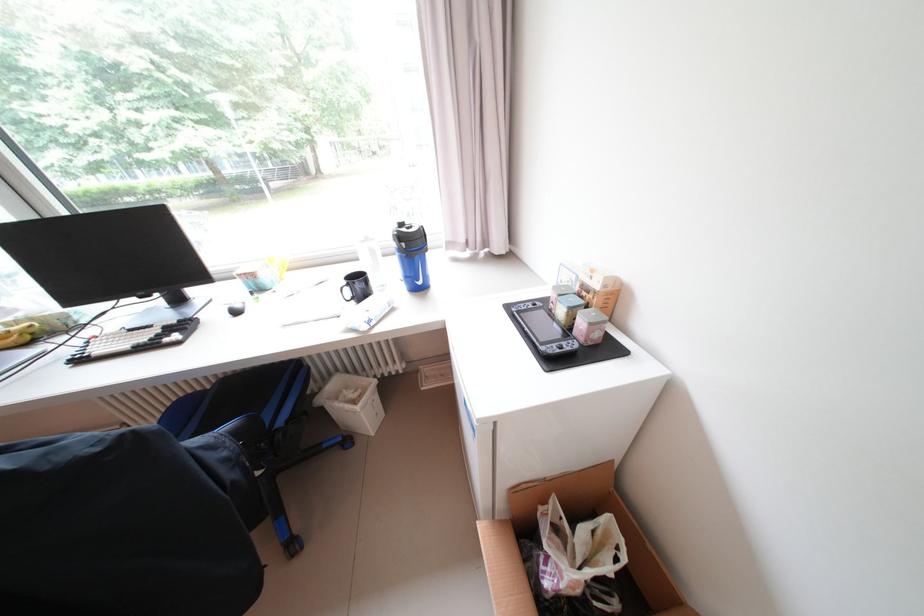
The location [411,254] corresponds to which object?

It corresponds to the light blue tin in the image.